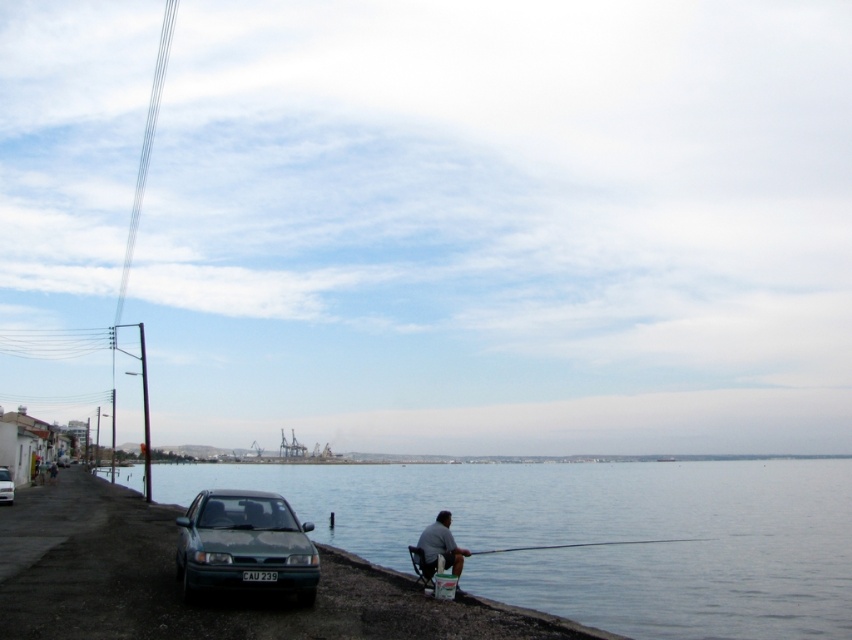
Question: Does gray fabric chair at lower center appear on the left side of smooth wooden rod at lower center?

Choices:
 (A) yes
 (B) no

Answer: (A)

Question: Estimate the real-world distances between objects in this image. Which object is farther from the green matte car at lower left?

Choices:
 (A) gray fabric chair at lower center
 (B) green matte sedan at lower left

Answer: (A)

Question: Estimate the real-world distances between objects in this image. Which object is closer to the clear water at lower left?

Choices:
 (A) green matte car at lower left
 (B) gray fabric chair at lower center
 (C) smooth wooden rod at lower center

Answer: (C)

Question: Does green matte sedan at lower left have a larger size compared to green matte car at lower left?

Choices:
 (A) yes
 (B) no

Answer: (A)

Question: Is gray fabric chair at lower center thinner than smooth wooden rod at lower center?

Choices:
 (A) no
 (B) yes

Answer: (B)

Question: Among these points, which one is farthest from the camera?

Choices:
 (A) (464, 548)
 (B) (9, 484)
 (C) (661, 538)
 (D) (246, 547)

Answer: (B)